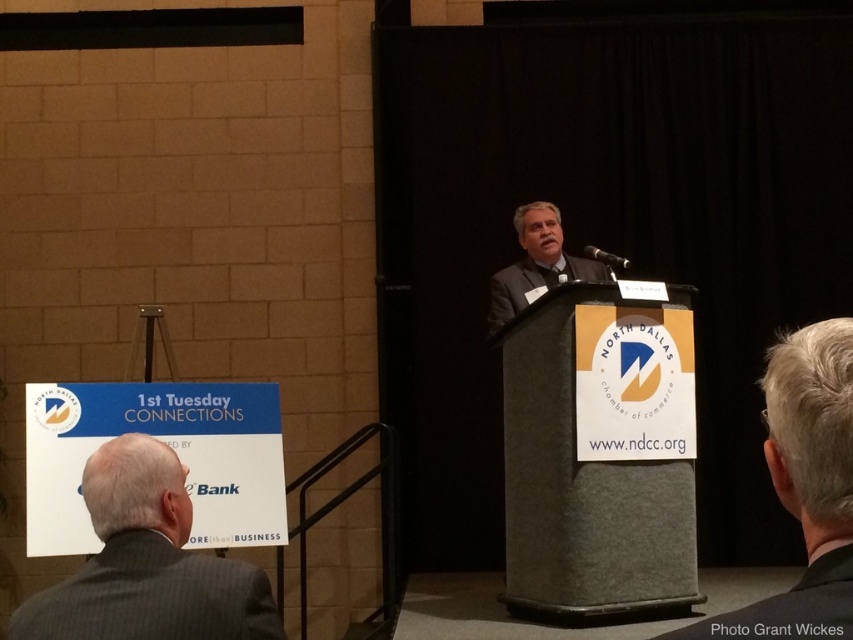
You are standing in the conference room and see the gray suit at lower left. If you want to approach and shake hands with the person wearing it, how many steps should you take if each step covers approximately 2.5 feet?

The gray suit at lower left is 5.99 feet away from viewer. Since each step covers 2.5 feet, you would need to take 2 steps to reach them, as 2 steps would cover 5 feet, leaving a remaining distance of 0.99 feet, which is close enough for a handshake.

Looking at this image, you are attending a formal event and see two people in the scene. One is wearing a gray suit at lower left, and the other has gray hair at center. Which person is located more to the left side of the scene?

The gray suit at lower left is positioned on the left side of gray hair at center, so the person in the gray suit at lower left is more to the left side of the scene.

You are standing at the podium and need to pass a document to both the gray suit at lower left and the gray suit at center. Given that you can only move forward in a straight line, which direction should you walk to reach both individuals efficiently?

Since the gray suit at lower left and gray suit at center are 3.26 meters apart from each other, you should walk forward towards the gray suit at lower left first, then proceed straight ahead to reach the gray suit at center as they are aligned in the same direction from the podium.